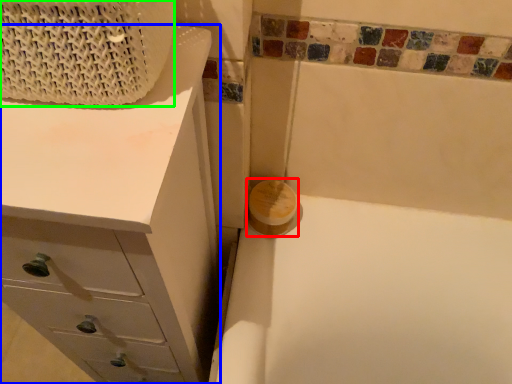
Question: Which is farther away from soap (highlighted by a red box)? chest of drawers (highlighted by a blue box) or basket (highlighted by a green box)?

Choices:
 (A) chest of drawers
 (B) basket

Answer: (B)